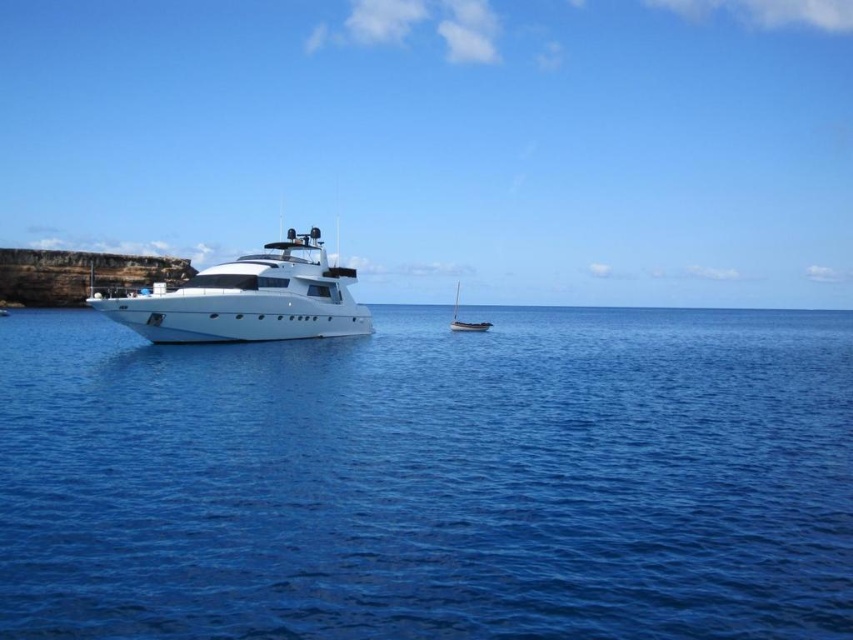
Who is shorter, blue liquid water at center or white glossy sailboat at center?

blue liquid water at center

How distant is blue liquid water at center from white glossy sailboat at center?

37.20 meters

Is point (643, 616) positioned before point (482, 323)?

Yes.

What are the coordinates of `blue liquid water at center` in the screenshot? It's located at (431, 477).

Between blue liquid water at center and white glossy yacht at center, which one has less height?

Standing shorter between the two is blue liquid water at center.

Who is more distant from viewer, (x=466, y=458) or (x=321, y=316)?

Point (x=321, y=316)

Which is in front, point (45, 506) or point (287, 301)?

Point (45, 506) is in front.

The height and width of the screenshot is (640, 853). Identify the location of blue liquid water at center. (431, 477).

Is white glossy yacht at center closer to the viewer compared to white glossy sailboat at center?

Yes, it is in front of white glossy sailboat at center.

Which of these two, white glossy yacht at center or white glossy sailboat at center, stands taller?

white glossy sailboat at center is taller.

The width and height of the screenshot is (853, 640). Describe the element at coordinates (248, 300) in the screenshot. I see `white glossy yacht at center` at that location.

This screenshot has width=853, height=640. I want to click on white glossy yacht at center, so click(248, 300).